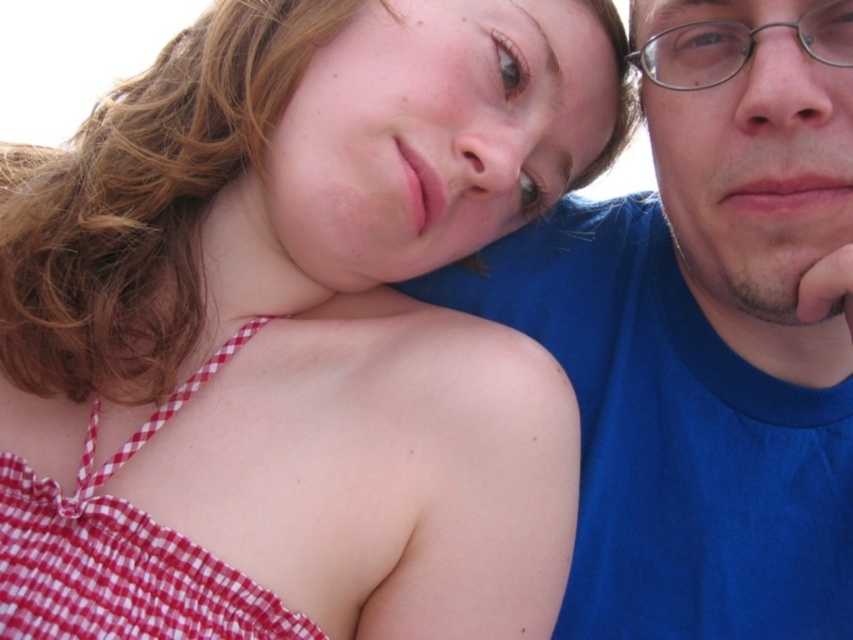
Which of these two, blue cotton shirt at upper right or red checkered dress at upper left, stands shorter?

red checkered dress at upper left is shorter.

Is point (711, 209) farther from camera compared to point (236, 589)?

Yes, point (711, 209) is behind point (236, 589).

This screenshot has width=853, height=640. I want to click on blue cotton shirt at upper right, so point(701,362).

Which is more to the left, blue cotton shirt at upper right or metallic silver glasses at upper right?

From the viewer's perspective, blue cotton shirt at upper right appears more on the left side.

Is blue cotton shirt at upper right thinner than metallic silver glasses at upper right?

In fact, blue cotton shirt at upper right might be wider than metallic silver glasses at upper right.

Measure the distance between blue cotton shirt at upper right and camera.

blue cotton shirt at upper right and camera are 37.38 inches apart from each other.

The width and height of the screenshot is (853, 640). I want to click on blue cotton shirt at upper right, so click(x=701, y=362).

Which of these two, red checkered dress at upper left or metallic silver glasses at upper right, stands shorter?

Standing shorter between the two is metallic silver glasses at upper right.

Identify the location of red checkered dress at upper left. The height and width of the screenshot is (640, 853). (120, 554).